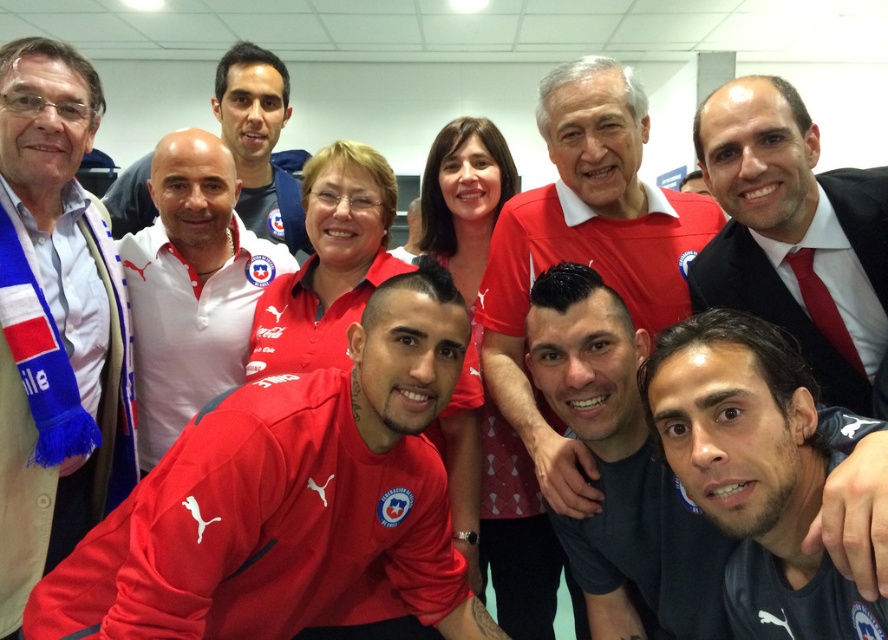
Which is more to the right, dark blue jersey at center or matte black suit at right?

matte black suit at right

This screenshot has height=640, width=888. Describe the element at coordinates (754, 470) in the screenshot. I see `dark blue jersey at center` at that location.

Locate an element on the screen. dark blue jersey at center is located at coordinates click(754, 470).

Locate an element on the screen. matte red jersey at center is located at coordinates (290, 499).

Is matte red jersey at center wider than white fabric scarf at upper left?

Yes, matte red jersey at center is wider than white fabric scarf at upper left.

The height and width of the screenshot is (640, 888). Identify the location of matte red jersey at center. (290, 499).

Can you confirm if matte red jersey at center is smaller than matte black suit at right?

Actually, matte red jersey at center might be larger than matte black suit at right.

Who is lower down, matte red jersey at center or matte black suit at right?

matte red jersey at center

Between point (329, 508) and point (748, 276), which one is positioned behind?

The point (748, 276) is behind.

Identify the location of matte red jersey at center. Image resolution: width=888 pixels, height=640 pixels. (290, 499).